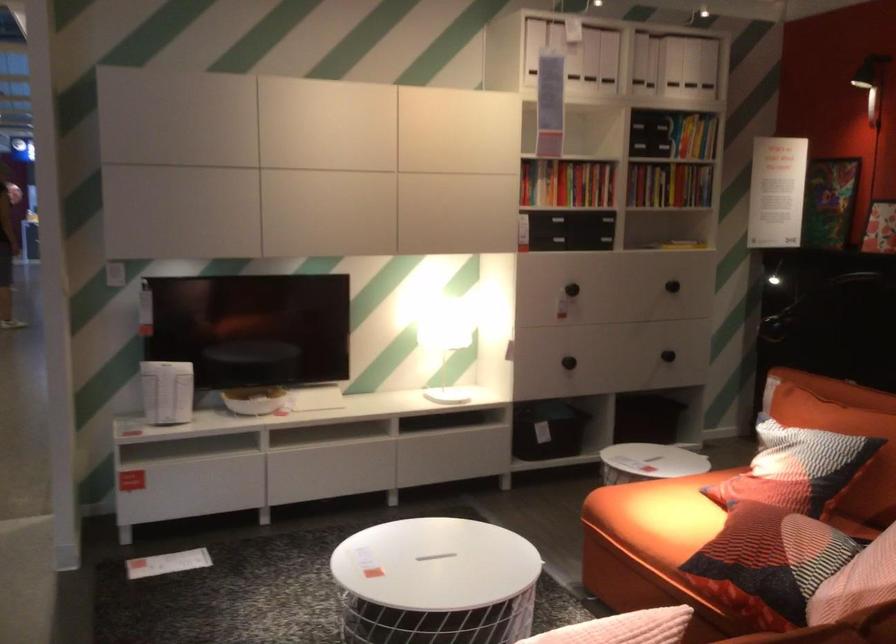
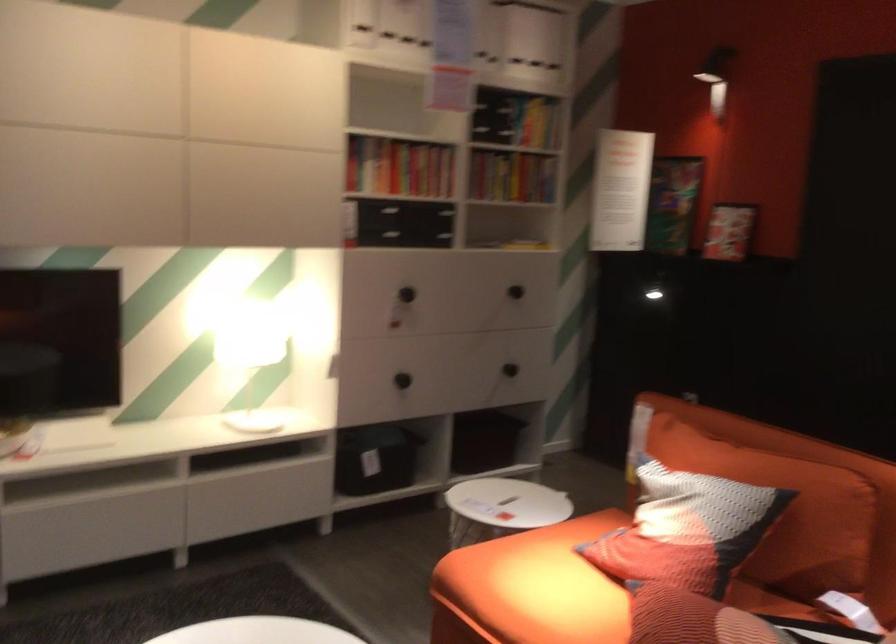
Find the pixel in the second image that matches (681,345) in the first image.

(510, 368)